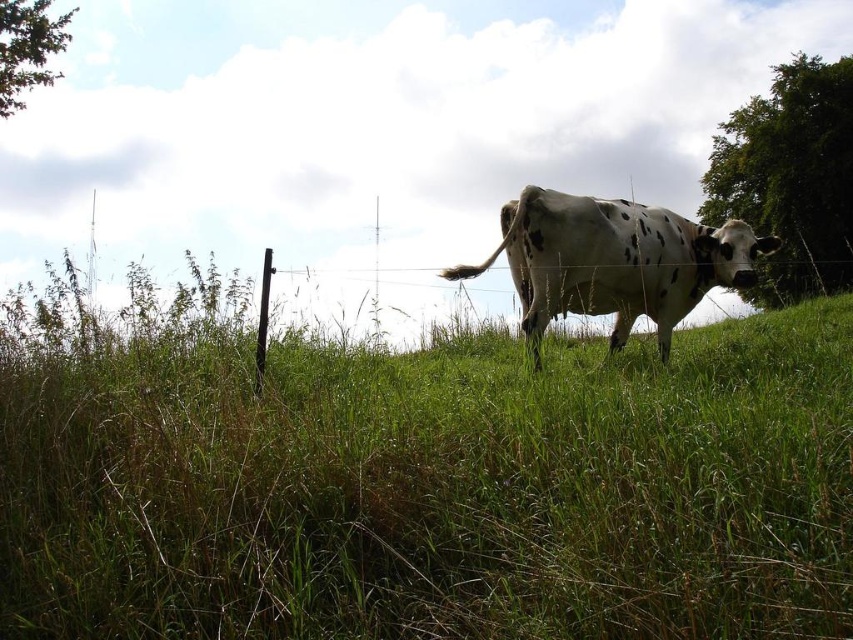
Between green leafy tree at upper right and green leafy tree at upper left, which one is positioned higher?

Positioned higher is green leafy tree at upper left.

Is green leafy tree at upper right positioned behind green leafy tree at upper left?

That is True.

Who is more distant from viewer, (809, 173) or (32, 44)?

The point (809, 173) is more distant.

Identify the location of green leafy tree at upper right. (790, 177).

Which is below, white spotted cow at center or green leafy tree at upper left?

Positioned lower is white spotted cow at center.

Describe the element at coordinates (614, 260) in the screenshot. The height and width of the screenshot is (640, 853). I see `white spotted cow at center` at that location.

At what (x,y) coordinates should I click in order to perform the action: click on white spotted cow at center. Please return your answer as a coordinate pair (x, y). This screenshot has height=640, width=853. Looking at the image, I should click on (614, 260).

The width and height of the screenshot is (853, 640). I want to click on white spotted cow at center, so click(x=614, y=260).

Who is shorter, green grassy at center or green leafy tree at upper right?

Standing shorter between the two is green grassy at center.

Between green grassy at center and green leafy tree at upper right, which one is positioned lower?

green grassy at center

Does point (190, 564) come in front of point (849, 221)?

Yes.

This screenshot has height=640, width=853. I want to click on green grassy at center, so click(432, 490).